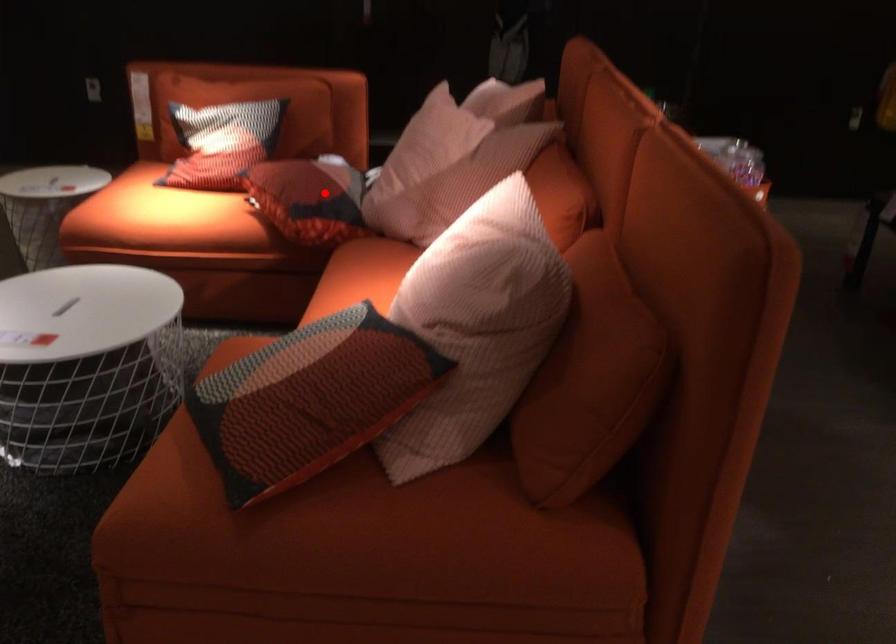
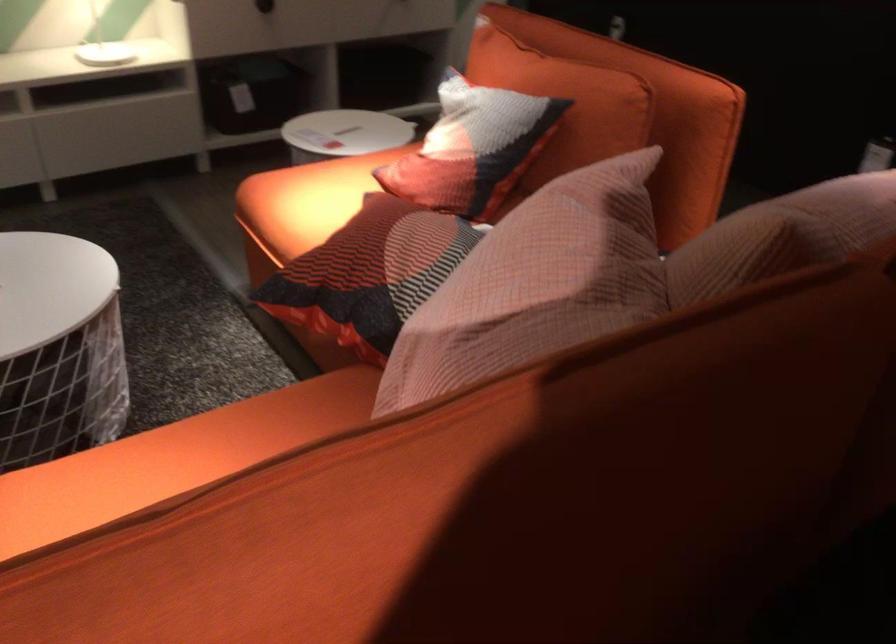
Question: I am providing you with two images of the same scene from different viewpoints. In image1, a red point is highlighted. Considering the same 3D point in image2, which of the following is correct?

Choices:
 (A) It is closer
 (B) It is farther

Answer: (A)